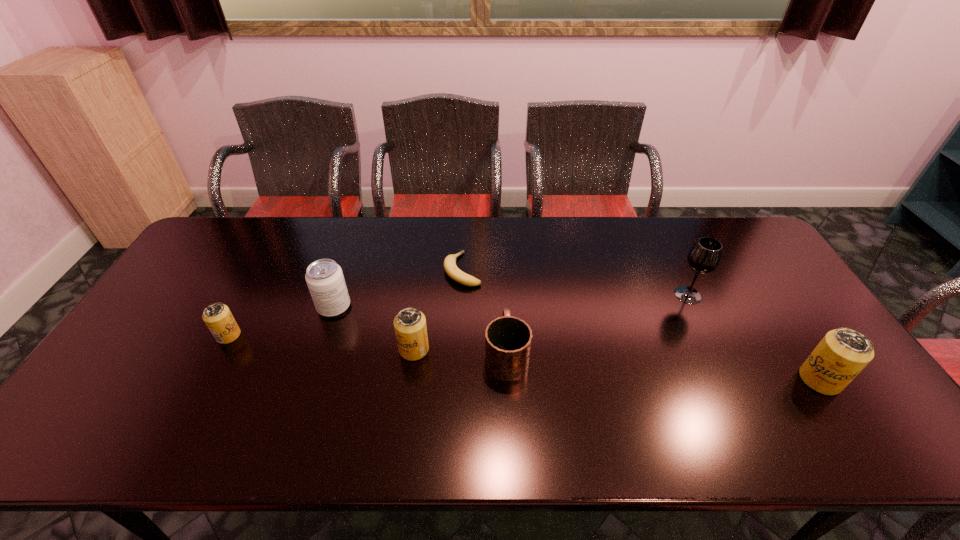
Identify which beer can is located as the second nearest to the shortest beer can. Please provide its 2D coordinates. Your answer should be formatted as a tuple, i.e. [(x, y)], where the tuple contains the x and y coordinates of a point satisfying the conditions above.

[(843, 353)]

This screenshot has width=960, height=540. What are the coordinates of `beer can that is the second closest to the mug` in the screenshot? It's located at (217, 316).

This screenshot has width=960, height=540. In order to click on vacant area in the image that satisfies the following two spatial constraints: 1. on the side of the tallest object with the handle; 2. on the left side of the mug in this screenshot , I will do `click(503, 295)`.

Where is `vacant space that satisfies the following two spatial constraints: 1. on the back side of the sixth object from right to left; 2. on the left side of the leftmost object`? This screenshot has width=960, height=540. vacant space that satisfies the following two spatial constraints: 1. on the back side of the sixth object from right to left; 2. on the left side of the leftmost object is located at coordinates 244,307.